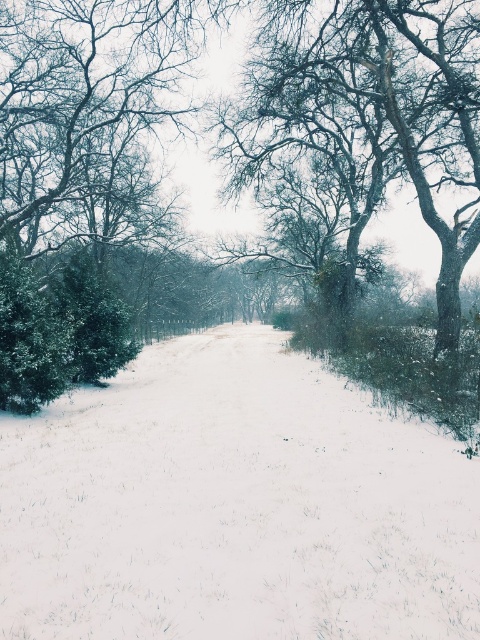
Can you confirm if white snow at center is smaller than snow-covered tree at center?

Indeed, white snow at center has a smaller size compared to snow-covered tree at center.

Image resolution: width=480 pixels, height=640 pixels. What are the coordinates of `white snow at center` in the screenshot? It's located at (233, 506).

Is point (226, 624) closer to camera compared to point (455, 8)?

Yes, point (226, 624) is closer to viewer.

Where is `white snow at center`? The image size is (480, 640). white snow at center is located at coordinates (233, 506).